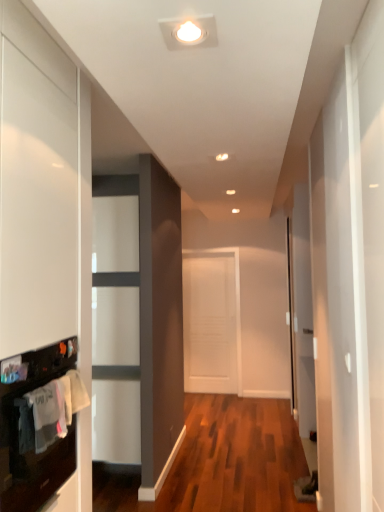
Measure the distance between white matte door at center and camera.

The distance of white matte door at center from camera is 5.59 meters.

What do you see at coordinates (210, 322) in the screenshot?
I see `white matte door at center` at bounding box center [210, 322].

Find the location of a particular element. This screenshot has width=384, height=512. white cotton laundry at left is located at coordinates (51, 411).

At what (x,y) coordinates should I click in order to perform the action: click on white matte door at center. Please return your answer as a coordinate pair (x, y). Looking at the image, I should click on (210, 322).

From a real-world perspective, is black glossy oven at lower left physically above white cotton laundry at left?

No, from a real-world perspective, black glossy oven at lower left is not above white cotton laundry at left.

Does point (35, 411) appear closer or farther from the camera than point (48, 419)?

Point (35, 411) is closer to the camera than point (48, 419).

Does black glossy oven at lower left have a smaller size compared to white cotton laundry at left?

Incorrect, black glossy oven at lower left is not smaller in size than white cotton laundry at left.

Looking at this image, based on their sizes in the image, would you say white cotton laundry at left is bigger or smaller than black glossy oven at lower left?

In the image, white cotton laundry at left appears to be smaller than black glossy oven at lower left.

Identify the location of laundry above the black glossy oven at lower left (from the image's perspective). The image size is (384, 512). (51, 411).

Considering the points (58, 386) and (50, 446), which point is behind, point (58, 386) or point (50, 446)?

The point (58, 386) is more distant.

Is white cotton laundry at left beside black glossy oven at lower left?

Yes, the surface of white cotton laundry at left is in contact with black glossy oven at lower left.

Find the location of `door below the black glossy oven at lower left (from a real-world perspective)`. door below the black glossy oven at lower left (from a real-world perspective) is located at coordinates (210, 322).

From the image's perspective, relative to white matte door at center, is black glossy oven at lower left above or below?

Based on their image positions, black glossy oven at lower left is located above white matte door at center.

Is black glossy oven at lower left not close to white matte door at center?

Indeed, black glossy oven at lower left is not near white matte door at center.

In the scene shown: Would you say black glossy oven at lower left contains white matte door at center?

No, white matte door at center is not inside black glossy oven at lower left.

Can you tell me how much white matte door at center and black glossy oven at lower left differ in facing direction?

There is a 88.8-degree angle between the facing directions of white matte door at center and black glossy oven at lower left.

Looking at this image, is white matte door at center placed right next to black glossy oven at lower left?

No, white matte door at center is not beside black glossy oven at lower left.

Is point (194, 330) positioned before point (22, 409)?

No, (194, 330) is further to viewer.

Is white matte door at center not inside black glossy oven at lower left?

Yes, white matte door at center is not within black glossy oven at lower left.

Is the position of white cotton laundry at left more distant than that of white matte door at center?

No.

Does point (63, 401) come in front of point (208, 307)?

Yes.

Is white cotton laundry at left inside or outside of white matte door at center?

white cotton laundry at left is not inside white matte door at center, it's outside.

Is white matte door at center touching white cotton laundry at left?

white matte door at center is not next to white cotton laundry at left, and they're not touching.

In terms of size, does white matte door at center appear bigger or smaller than white cotton laundry at left?

white matte door at center is bigger than white cotton laundry at left.

Looking at their sizes, would you say white matte door at center is wider or thinner than white cotton laundry at left?

white matte door at center is wider than white cotton laundry at left.

Is white matte door at center at the left side of white cotton laundry at left?

No.

You are a GUI agent. You are given a task and a screenshot of the screen. Output one action in this format:
    pyautogui.click(x=<x>, y=<y>)
    Task: Click on the laundry lying behind the black glossy oven at lower left
    This screenshot has width=384, height=512.
    Given the screenshot: What is the action you would take?
    pyautogui.click(x=51, y=411)

The height and width of the screenshot is (512, 384). In order to click on laundry above the black glossy oven at lower left (from a real-world perspective) in this screenshot , I will do `click(51, 411)`.

When comparing their distances from white matte door at center, does black glossy oven at lower left or white cotton laundry at left seem further?

Among the two, white cotton laundry at left is located further to white matte door at center.

When comparing their distances from black glossy oven at lower left, does white matte door at center or white cotton laundry at left seem further?

The object further to black glossy oven at lower left is white matte door at center.

Which object lies further to the anchor point white cotton laundry at left, white matte door at center or black glossy oven at lower left?

white matte door at center.

From the image, which object appears to be farther from black glossy oven at lower left, white cotton laundry at left or white matte door at center?

white matte door at center is further to black glossy oven at lower left.

Considering their positions, is black glossy oven at lower left positioned further to white cotton laundry at left than white matte door at center?

Among the two, white matte door at center is located further to white cotton laundry at left.

Based on their spatial positions, is white cotton laundry at left or black glossy oven at lower left closer to white matte door at center?

black glossy oven at lower left lies closer to white matte door at center than the other object.

You are a GUI agent. You are given a task and a screenshot of the screen. Output one action in this format:
    pyautogui.click(x=<x>, y=<y>)
    Task: Click on the laundry between black glossy oven at lower left and white matte door at center in the front-back direction
    Image resolution: width=384 pixels, height=512 pixels.
    Given the screenshot: What is the action you would take?
    pyautogui.click(x=51, y=411)